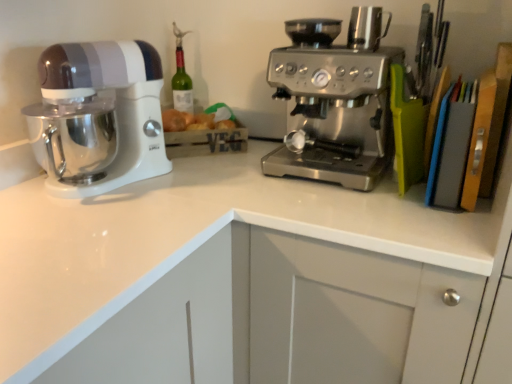
Question: Is satin silver coffee maker at center bigger or smaller than white glossy countertop at center?

Choices:
 (A) small
 (B) big

Answer: (A)

Question: From their relative heights in the image, would you say satin silver coffee maker at center is taller or shorter than white glossy countertop at center?

Choices:
 (A) tall
 (B) short

Answer: (B)

Question: Estimate the real-world distances between objects in this image. Which object is closer to the white glossy mixer at left?

Choices:
 (A) stainless steel coffee maker at upper right
 (B) satin silver coffee maker at center
 (C) white glossy countertop at center

Answer: (C)

Question: Estimate the real-world distances between objects in this image. Which object is farther from the stainless steel coffee maker at upper right?

Choices:
 (A) white glossy countertop at center
 (B) white glossy mixer at left
 (C) satin silver coffee maker at center

Answer: (B)